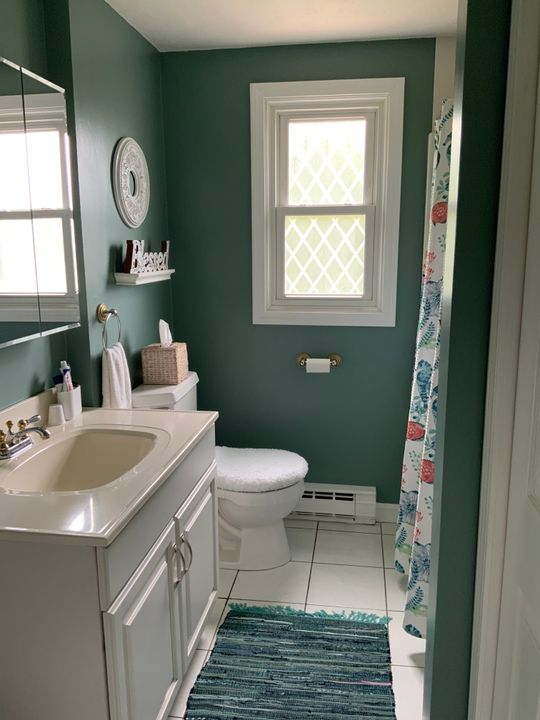
Identify the location of 1 faucet. The height and width of the screenshot is (720, 540). (48, 438).